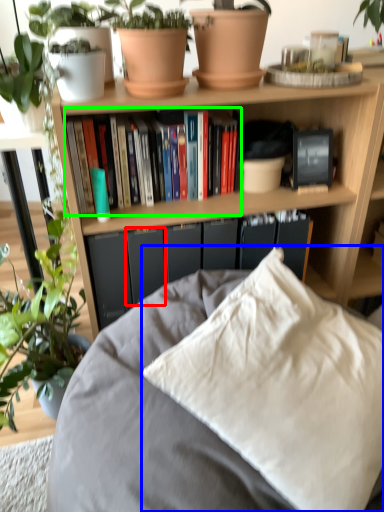
Question: Which object is the closest to the paperback book (highlighted by a red box)? Choose among these: pillow (highlighted by a blue box) or book (highlighted by a green box).

Choices:
 (A) pillow
 (B) book

Answer: (B)